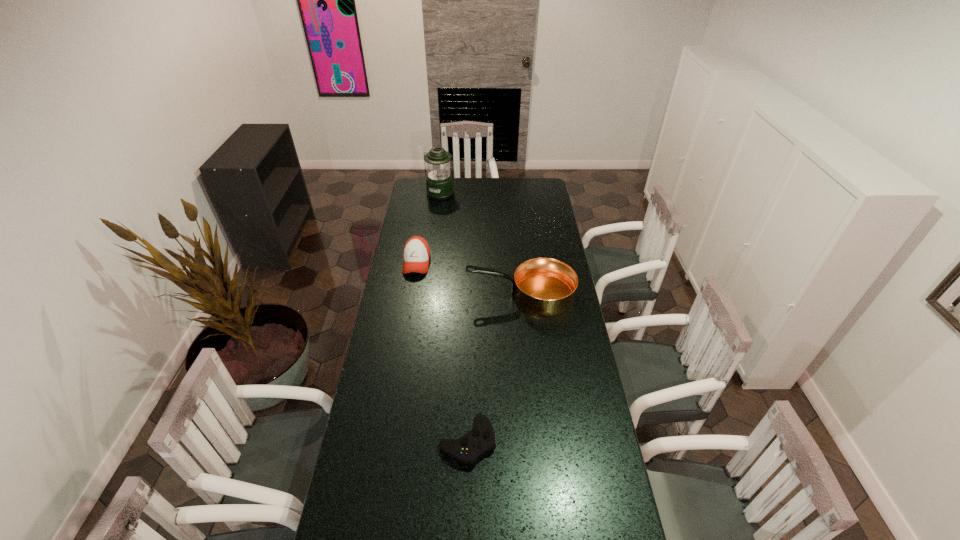
Identify the location of the farthest object. Image resolution: width=960 pixels, height=540 pixels. (439, 182).

Where is `lantern`? This screenshot has width=960, height=540. lantern is located at coordinates (439, 182).

What are the coordinates of `the second tallest object` in the screenshot? It's located at (543, 286).

Image resolution: width=960 pixels, height=540 pixels. I want to click on the second shortest object, so click(416, 253).

This screenshot has height=540, width=960. I want to click on the nearest object, so click(470, 447).

Find the location of a particular element. the shortest object is located at coordinates (470, 447).

Locate an element on the screen. vacant region located 0.290m on the right of the farthest object is located at coordinates (503, 193).

Image resolution: width=960 pixels, height=540 pixels. I want to click on free space located 0.110m on the handle side of the second tallest object, so click(443, 295).

Find the location of `free space located on the handle side of the second tallest object`. free space located on the handle side of the second tallest object is located at coordinates (410, 295).

Locate an element on the screen. vacant region located on the handle side of the second tallest object is located at coordinates (414, 295).